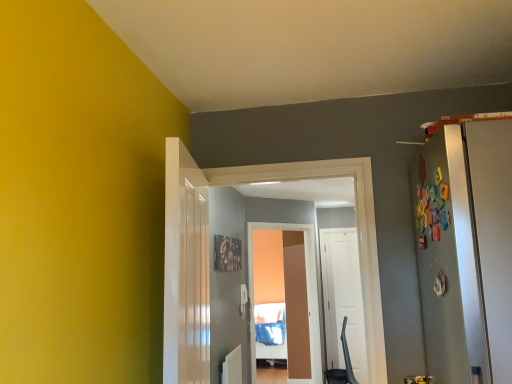
Question: From a real-world perspective, is white matte door at center, the 1th door in the right-to-left sequence, below white glossy door at center, arranged as the third door when viewed from the right?

Choices:
 (A) no
 (B) yes

Answer: (B)

Question: Does white matte door at center, the 3th door positioned from the left, have a greater height compared to white glossy door at center, arranged as the third door when viewed from the right?

Choices:
 (A) no
 (B) yes

Answer: (B)

Question: Is white matte door at center, the 1th door in the right-to-left sequence, not close to white glossy door at center, the third door from the back?

Choices:
 (A) no
 (B) yes

Answer: (B)

Question: Considering the relative sizes of white matte door at center, placed as the 3th door when sorted from front to back, and white glossy door at center, the third door from the back, in the image provided, is white matte door at center, placed as the 3th door when sorted from front to back, wider than white glossy door at center, the third door from the back,?

Choices:
 (A) no
 (B) yes

Answer: (A)

Question: Is white matte door at center, the 1th door positioned from the back, oriented away from white glossy door at center, arranged as the third door when viewed from the right?

Choices:
 (A) yes
 (B) no

Answer: (B)

Question: From the image's perspective, is white matte door at center, placed as the 3th door when sorted from front to back, below white glossy door at center, the 1th door positioned from the left?

Choices:
 (A) yes
 (B) no

Answer: (A)

Question: Can you confirm if matte brown screen door at center is smaller than white matte door at center, placed as the 3th door when sorted from front to back?

Choices:
 (A) yes
 (B) no

Answer: (B)

Question: Is matte brown screen door at center closer to the viewer compared to white matte door at center, the 1th door in the right-to-left sequence?

Choices:
 (A) no
 (B) yes

Answer: (B)

Question: Does matte brown screen door at center appear on the left side of white matte door at center, placed as the 3th door when sorted from front to back?

Choices:
 (A) no
 (B) yes

Answer: (B)

Question: Does matte brown screen door at center have a greater height compared to white matte door at center, the 1th door in the right-to-left sequence?

Choices:
 (A) no
 (B) yes

Answer: (B)

Question: Can you confirm if matte brown screen door at center is thinner than white matte door at center, placed as the 3th door when sorted from front to back?

Choices:
 (A) yes
 (B) no

Answer: (B)

Question: Considering the relative sizes of matte brown screen door at center and white matte door at center, the 3th door positioned from the left, in the image provided, is matte brown screen door at center wider than white matte door at center, the 3th door positioned from the left,?

Choices:
 (A) no
 (B) yes

Answer: (B)